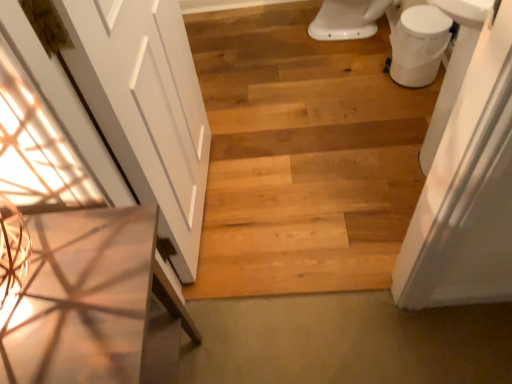
Locate an element on the screen. This screenshot has width=512, height=384. free point below white matte door at left (from a real-world perspective) is located at coordinates (211, 207).